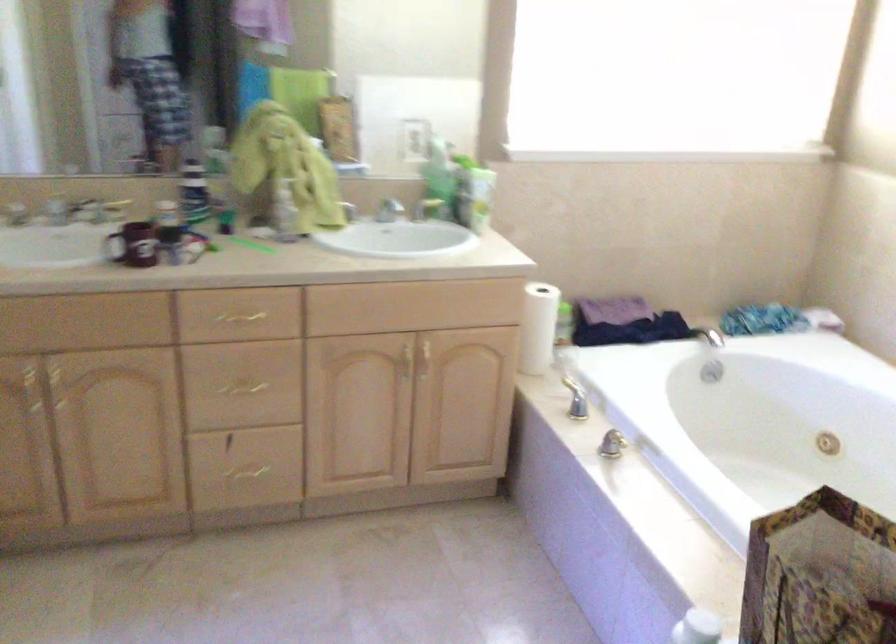
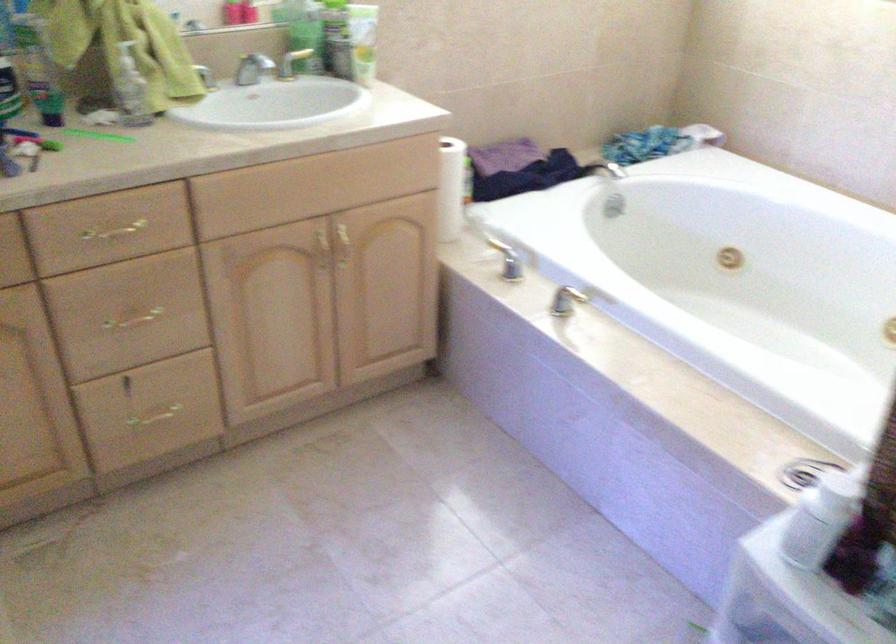
In the second image, find the point that corresponds to (x=407, y=359) in the first image.

(321, 249)